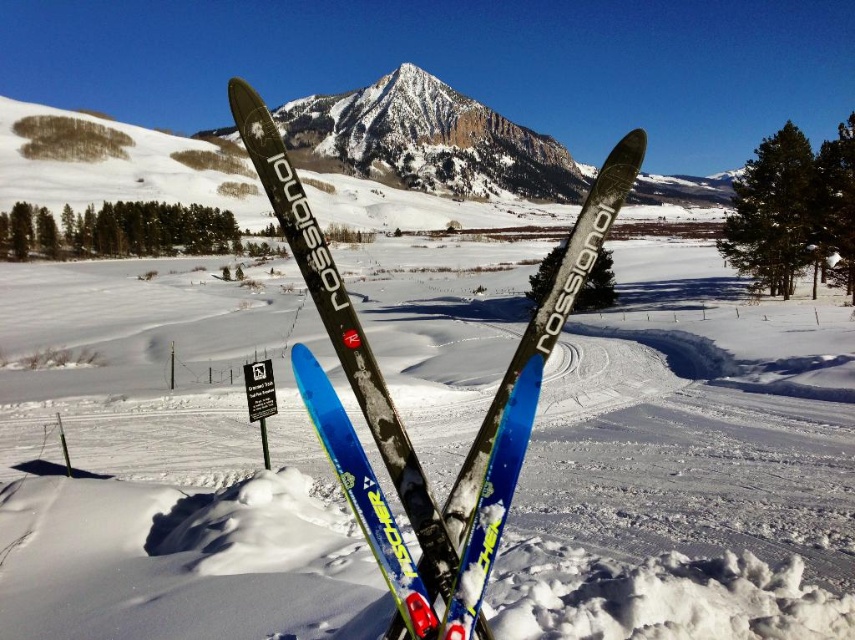
Question: Does blue glossy fischer skis at center have a smaller size compared to snowy granite peak at center?

Choices:
 (A) yes
 (B) no

Answer: (A)

Question: Which point is farther from the camera taking this photo?

Choices:
 (A) (308, 260)
 (B) (538, 145)

Answer: (B)

Question: Observing the image, what is the correct spatial positioning of blue glossy fischer skis at center in reference to snowy granite peak at center?

Choices:
 (A) right
 (B) left

Answer: (A)

Question: Which of the following is the closest to the observer?

Choices:
 (A) snowy granite peak at center
 (B) blue glossy fischer skis at center

Answer: (B)

Question: Does blue glossy fischer skis at center have a greater width compared to snowy granite peak at center?

Choices:
 (A) yes
 (B) no

Answer: (B)